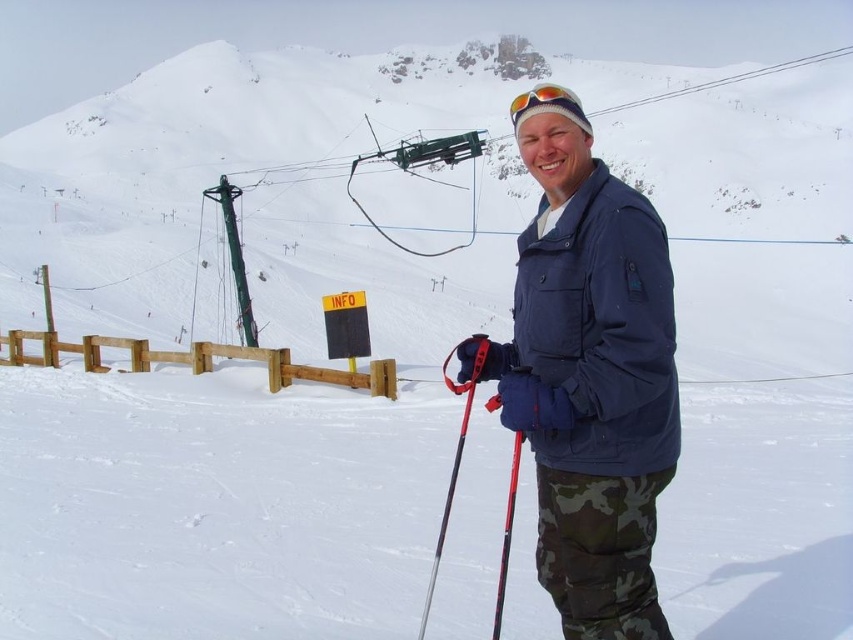
Question: Which object is the farthest from the blue fabric jacket at center?

Choices:
 (A) multicolored plastic goggles at center
 (B) metallic ski pole at center
 (C) red plastic ski pole at center

Answer: (A)

Question: Considering the relative positions of blue fabric jacket at center and metallic ski pole at center in the image provided, where is blue fabric jacket at center located with respect to metallic ski pole at center?

Choices:
 (A) right
 (B) left

Answer: (A)

Question: Which object appears closest to the camera in this image?

Choices:
 (A) metallic ski pole at center
 (B) multicolored plastic goggles at center
 (C) blue fabric jacket at center

Answer: (C)

Question: Is blue fabric jacket at center to the left of camo fabric pants at lower right from the viewer's perspective?

Choices:
 (A) no
 (B) yes

Answer: (B)

Question: Which object is farther from the camera taking this photo?

Choices:
 (A) blue fabric jacket at center
 (B) red plastic ski pole at center
 (C) camo fabric pants at lower right

Answer: (A)

Question: Can you confirm if camo fabric pants at lower right is bigger than red plastic ski pole at center?

Choices:
 (A) no
 (B) yes

Answer: (A)